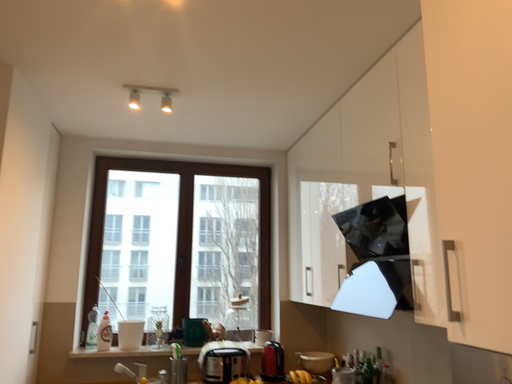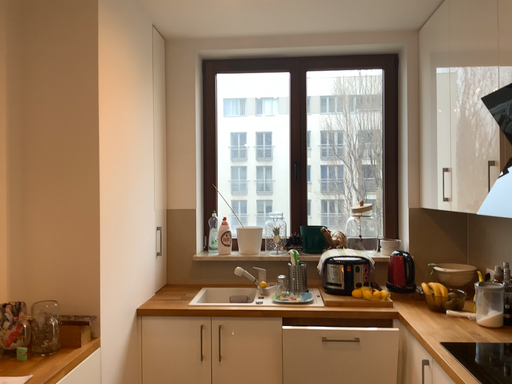
Question: How did the camera likely rotate when shooting the video?

Choices:
 (A) rotated downward
 (B) rotated upward

Answer: (A)